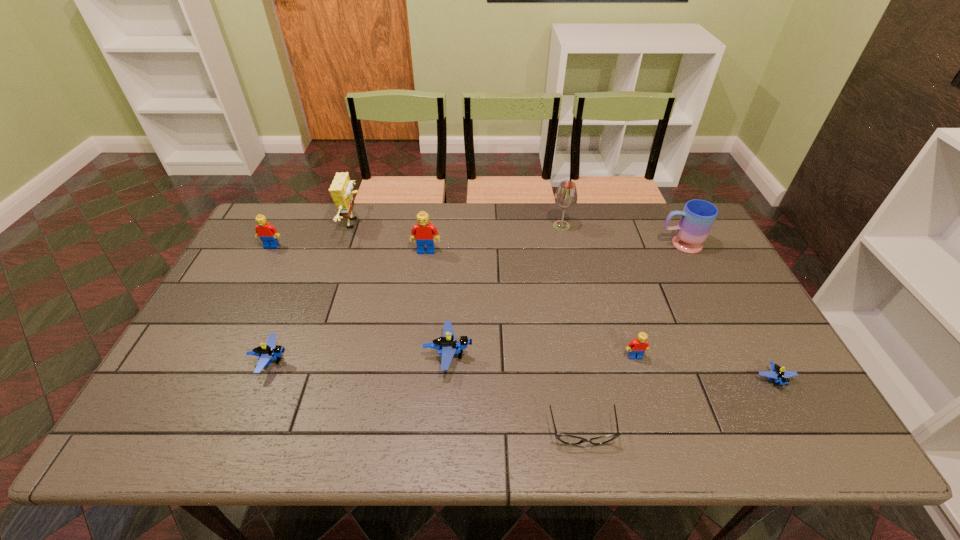
Identify the location of free space that is in between the wineglass and the tallest Lego. (494, 238).

Find the location of a particular element. free space between the black spectacles and the mug is located at coordinates (631, 338).

Choose which object is the fourth nearest neighbor to the biggest blue Lego. Please provide its 2D coordinates. Your answer should be formatted as a tuple, i.e. [(x, y)], where the tuple contains the x and y coordinates of a point satisfying the conditions above.

[(637, 347)]

Where is `object that is the fifth closest to the second object from left to right`? The width and height of the screenshot is (960, 540). object that is the fifth closest to the second object from left to right is located at coordinates (x=564, y=438).

You are a GUI agent. You are given a task and a screenshot of the screen. Output one action in this format:
    pyautogui.click(x=<x>, y=<y>)
    Task: Click on the Lego that stands as the sixth closest to the wineglass
    This screenshot has width=960, height=540.
    Given the screenshot: What is the action you would take?
    pyautogui.click(x=267, y=233)

At what (x,y) coordinates should I click in order to perform the action: click on the fifth closest Lego to the second blue Lego from right to left. Please return your answer as a coordinate pair (x, y). Image resolution: width=960 pixels, height=540 pixels. Looking at the image, I should click on (781, 377).

Identify which red Lego is the third closest to the fifth tallest Lego. Please provide its 2D coordinates. Your answer should be formatted as a tuple, i.e. [(x, y)], where the tuple contains the x and y coordinates of a point satisfying the conditions above.

[(637, 347)]

Select which red Lego is the closest to the second smallest red Lego. Please provide its 2D coordinates. Your answer should be formatted as a tuple, i.e. [(x, y)], where the tuple contains the x and y coordinates of a point satisfying the conditions above.

[(424, 233)]

Find the location of a particular element. The width and height of the screenshot is (960, 540). the closest blue Lego to the biggest blue Lego is located at coordinates (266, 352).

Locate which blue Lego is the closest to the yellow sponge. Please provide its 2D coordinates. Your answer should be formatted as a tuple, i.e. [(x, y)], where the tuple contains the x and y coordinates of a point satisfying the conditions above.

[(266, 352)]